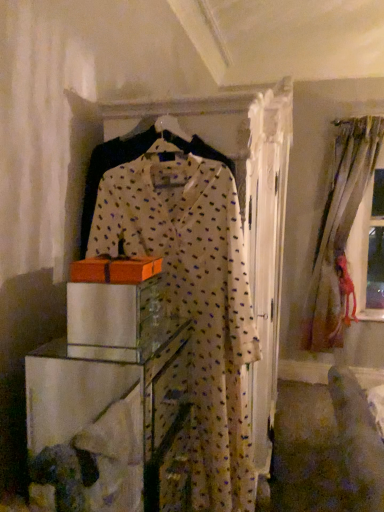
Question: Should I look upward or downward to see silky beige curtains at right?

Choices:
 (A) up
 (B) down

Answer: (A)

Question: Considering the relative sizes of white dotted fabric dress at center and silky beige curtains at right in the image provided, is white dotted fabric dress at center bigger than silky beige curtains at right?

Choices:
 (A) yes
 (B) no

Answer: (B)

Question: Is white dotted fabric dress at center looking in the opposite direction of silky beige curtains at right?

Choices:
 (A) no
 (B) yes

Answer: (B)

Question: From the image's perspective, is white dotted fabric dress at center beneath silky beige curtains at right?

Choices:
 (A) no
 (B) yes

Answer: (B)

Question: Considering the relative positions of white dotted fabric dress at center and silky beige curtains at right in the image provided, is white dotted fabric dress at center behind silky beige curtains at right?

Choices:
 (A) yes
 (B) no

Answer: (B)

Question: From the image's perspective, is white dotted fabric dress at center above silky beige curtains at right?

Choices:
 (A) yes
 (B) no

Answer: (B)

Question: Is white dotted fabric dress at center positioned in front of silky beige curtains at right?

Choices:
 (A) yes
 (B) no

Answer: (A)

Question: Is clear glass cabinet at center shorter than silky beige curtains at right?

Choices:
 (A) yes
 (B) no

Answer: (A)

Question: Considering the relative positions of clear glass cabinet at center and silky beige curtains at right in the image provided, is clear glass cabinet at center in front of silky beige curtains at right?

Choices:
 (A) yes
 (B) no

Answer: (A)

Question: From a real-world perspective, is clear glass cabinet at center beneath silky beige curtains at right?

Choices:
 (A) yes
 (B) no

Answer: (A)

Question: Can you confirm if clear glass cabinet at center is bigger than silky beige curtains at right?

Choices:
 (A) no
 (B) yes

Answer: (A)

Question: Considering the relative sizes of clear glass cabinet at center and silky beige curtains at right in the image provided, is clear glass cabinet at center thinner than silky beige curtains at right?

Choices:
 (A) no
 (B) yes

Answer: (A)

Question: From the image's perspective, is clear glass cabinet at center on top of silky beige curtains at right?

Choices:
 (A) yes
 (B) no

Answer: (B)

Question: Is silky beige curtains at right bigger than clear glass cabinet at center?

Choices:
 (A) no
 (B) yes

Answer: (B)